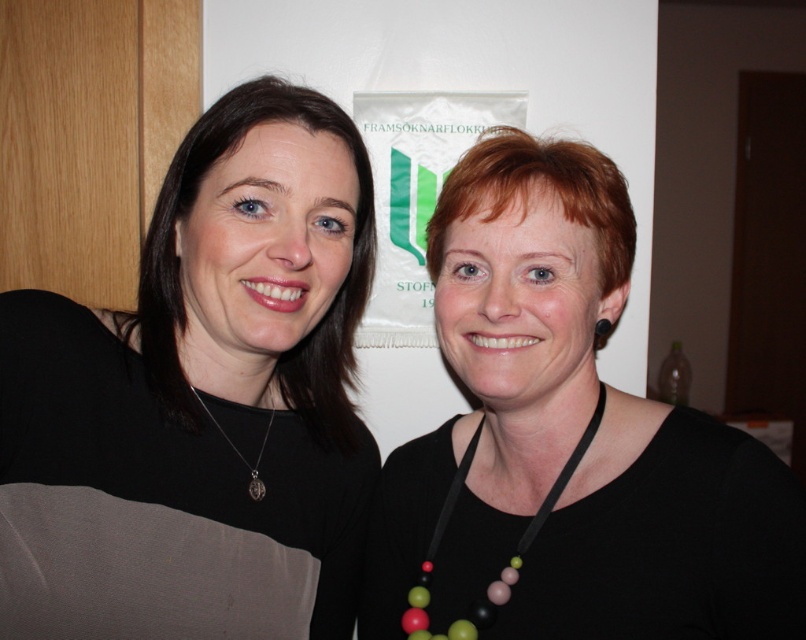
You are a photographer taking a portrait of the two people in the scene. You want to ensure that both necklaces are clearly visible in the photo. Given that the black matte necklace at center is larger than the silver metallic pendant at center, which necklace might you need to focus on more to ensure it stands out against the background?

The black matte necklace at center is bigger than the silver metallic pendant at center, so focusing on the black matte necklace at center would ensure it stands out more due to its larger size.

You are a photographer adjusting lighting for a portrait. You need to ensure both the black matte necklace at upper left and the multicolored beads at center are well lit. Which object should you focus the light on first to ensure it doesn

The black matte necklace at upper left is taller than the multicolored beads at center, so you should focus the light on the black matte necklace at upper left first to ensure it is properly illuminated before adjusting for the smaller multicolored beads at center.